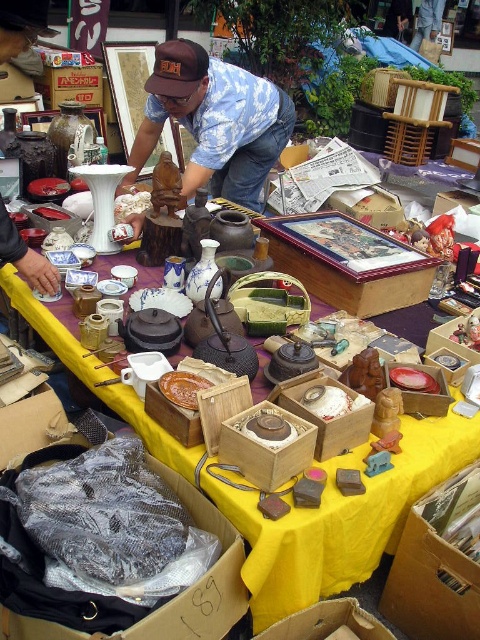
You are a customer at the flea market and want to place a small item between the wooden box with painted picture at center and the brown wooden plate at center. The item is 12 inches long. Can it fit in the space between them?

The distance between the wooden box with painted picture at center and the brown wooden plate at center is 38.48 inches. Since the item is only 12 inches long, it can easily fit in the space between them.

You are a customer at the flea market and want to buy both the cardboard box at lower center and the white matte rice at center. Which item should you approach first if you are standing to the right of the table?

Since the cardboard box at lower center is to the left of the white matte rice at center, you should approach the white matte rice at center first if you are standing to the right of the table. This way, you can move from right to left, starting with the item closer to your position.

You are a customer at the flea market looking to purchase the wooden box with painted picture at center and the brown wooden plate at center. You want to know which item is placed higher on the table. Which one is higher?

The wooden box with painted picture at center is above the brown wooden plate at center, so it is placed higher on the table.